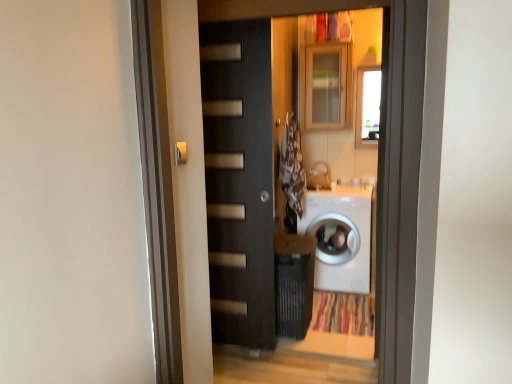
Question: Looking at their shapes, would you say matte black door at center is wider or thinner than white glossy washing machine at center?

Choices:
 (A) thin
 (B) wide

Answer: (A)

Question: Visually, is matte black door at center positioned to the left or to the right of white glossy washing machine at center?

Choices:
 (A) left
 (B) right

Answer: (A)

Question: Which object is positioned farthest from the white glossy washing machine at center?

Choices:
 (A) matte black door at center
 (B) wooden cabinet at upper center
 (C) brown fabric laundry at center
 (D) metallic silver door handle at upper center

Answer: (D)

Question: Estimate the real-world distances between objects in this image. Which object is closer to the metallic silver door handle at upper center?

Choices:
 (A) wooden cabinet at upper center
 (B) white glossy washing machine at center
 (C) brown fabric laundry at center
 (D) matte black door at center

Answer: (D)